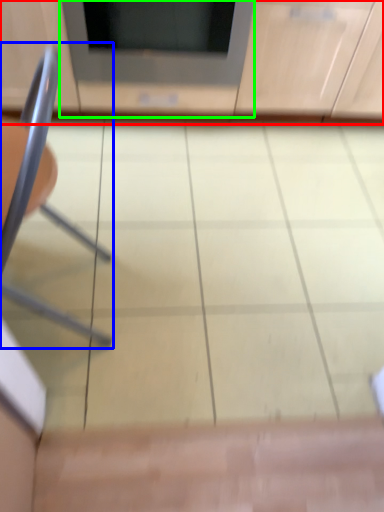
Question: Which is nearer to the cabinetry (highlighted by a red box)? chair (highlighted by a blue box) or appliance (highlighted by a green box).

Choices:
 (A) chair
 (B) appliance

Answer: (B)